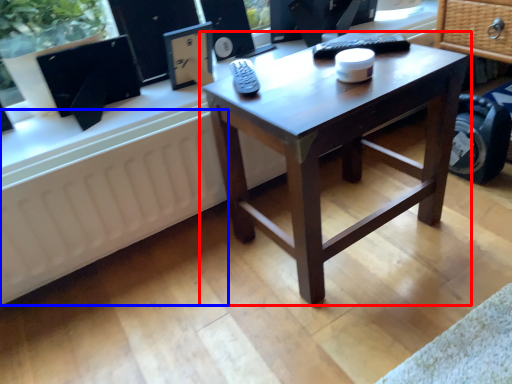
Question: Which object appears farthest to the camera in this image, coffee table (highlighted by a red box) or radiator (highlighted by a blue box)?

Choices:
 (A) coffee table
 (B) radiator

Answer: (B)